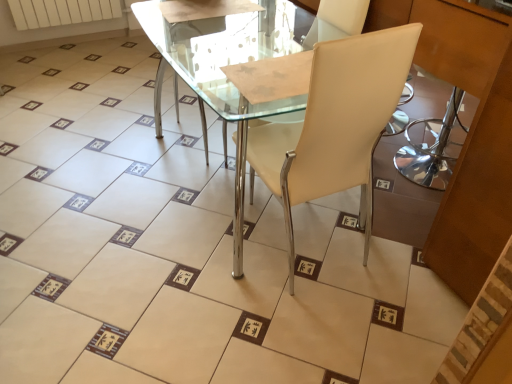
Where is `free space underneath white matte radiator at upper left (from a real-world perspective)`? The height and width of the screenshot is (384, 512). free space underneath white matte radiator at upper left (from a real-world perspective) is located at coordinates 81,43.